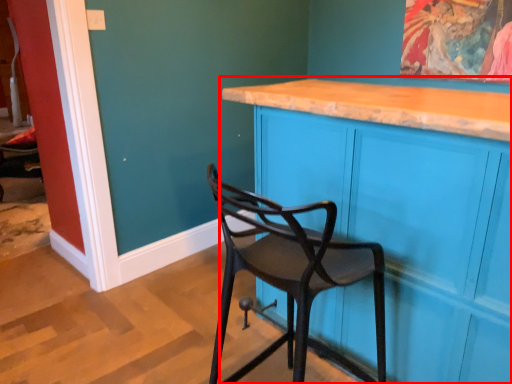
Question: From the image's perspective, what is the correct spatial relationship of cabinetry (annotated by the red box) in relation to chair?

Choices:
 (A) above
 (B) below

Answer: (A)